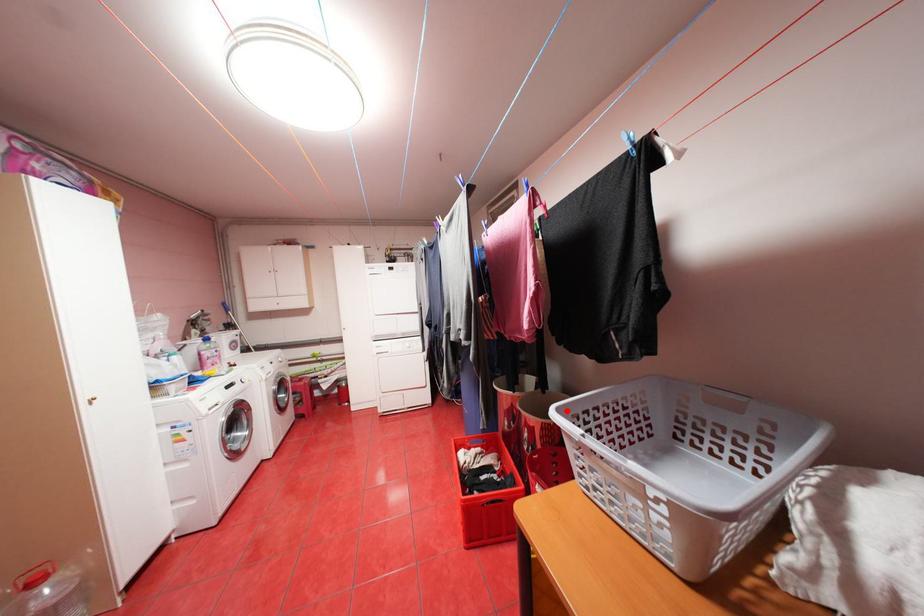
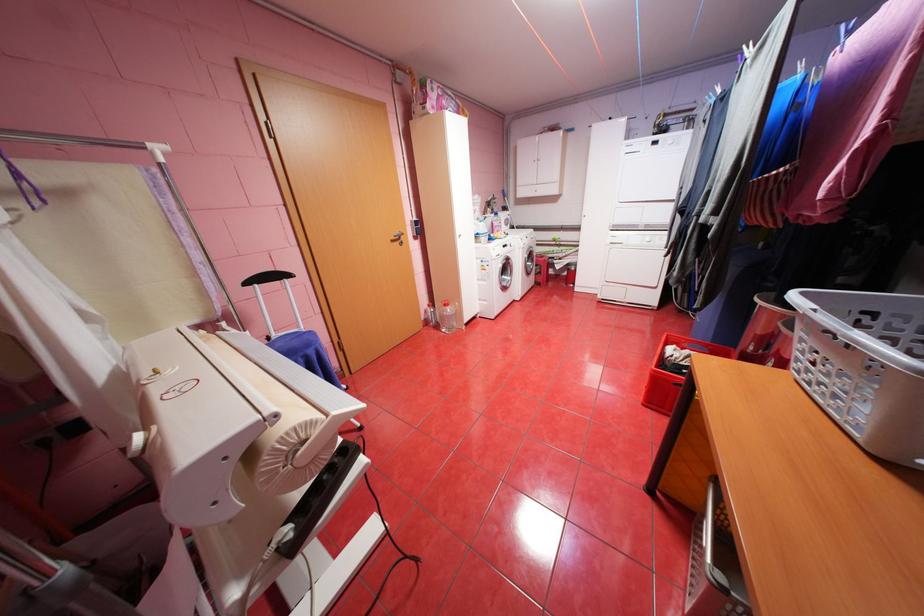
Find the pixel in the second image that matches the highlighted location in the first image.

(811, 293)